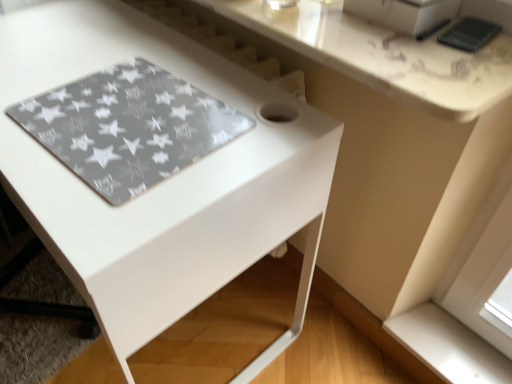
Locate an element on the screen. free spot below transparent star-patterned mat at lower left (from a real-world perspective) is located at coordinates (139, 123).